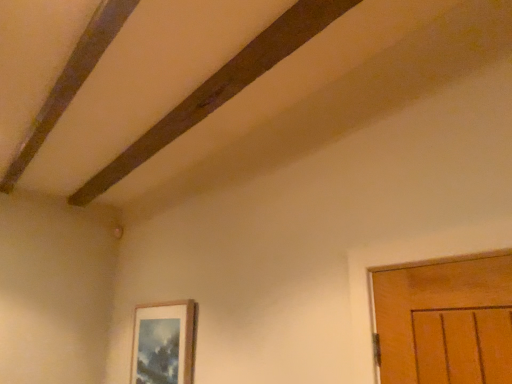
What do you see at coordinates (163, 343) in the screenshot?
I see `wooden framed picture at lower left` at bounding box center [163, 343].

You are a GUI agent. You are given a task and a screenshot of the screen. Output one action in this format:
    pyautogui.click(x=<x>, y=<y>)
    Task: Click on the wooden framed picture at lower left
    
    Given the screenshot: What is the action you would take?
    pyautogui.click(x=163, y=343)

Identify the location of wooden framed picture at lower left. The height and width of the screenshot is (384, 512). pos(163,343).